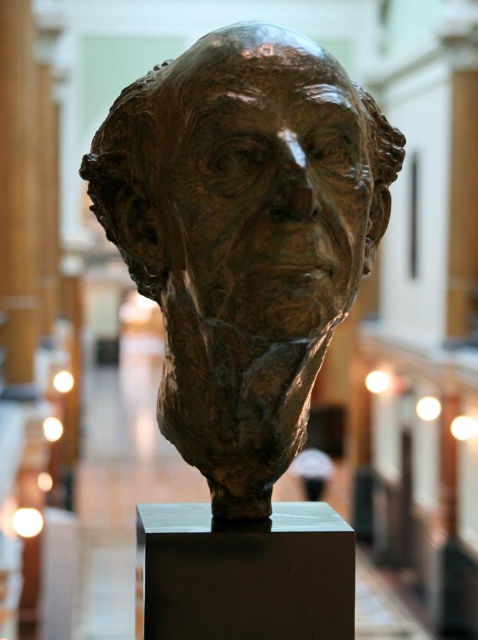
Consider the image. You are a museum curator planning to install a new spotlight for the bronze sculpture at center. The spotlight needs to be placed at coordinates exactly 0.3 units to the right and 0.5 units above the sculpture. What are the coordinates where you should place the spotlight?

The bronze sculpture at center is at point (x=247, y=180). Adding 0.3 to the x coordinate gives 0.283 0.3 0.583. Adding 0.5 to the y coordinate gives 0.517 0.5 1.017. So the spotlight should be placed at coordinates (x=477, y=372).

You are an art conservator assessing the stability of the bronze sculpture at center and the matte black pedestal at center. Based on their heights, which object is more likely to tip over if a slight force is applied?

The bronze sculpture at center is much taller than the matte black pedestal at center, making it more top heavy and thus more prone to tipping over when a slight force is applied.

You are standing in a museum and want to take a photo of the bronze sculpture at center. The museum requires visitors to stay at least 1 meter away from the sculpture. If you are currently at point (247, 180), which is where the bronze sculpture at center is located, are you violating the museum policy?

Yes, you are violating the museum policy because you are currently at the same location as the bronze sculpture at center, which means you are not maintaining the required 1 meter distance.